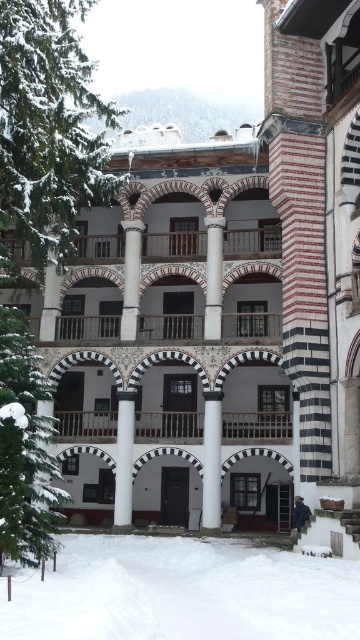
Can you confirm if white smooth column at center is bigger than white marble column at center?

Indeed, white smooth column at center has a larger size compared to white marble column at center.

The width and height of the screenshot is (360, 640). What do you see at coordinates (212, 460) in the screenshot? I see `white smooth column at center` at bounding box center [212, 460].

The width and height of the screenshot is (360, 640). Describe the element at coordinates (212, 460) in the screenshot. I see `white smooth column at center` at that location.

In order to click on white smooth column at center in this screenshot , I will do (x=212, y=460).

Can you confirm if white smooth column at center is wider than white glossy column at center?

No, white smooth column at center is not wider than white glossy column at center.

Does white smooth column at center have a larger size compared to white glossy column at center?

Yes.

I want to click on white smooth column at center, so click(x=212, y=460).

Image resolution: width=360 pixels, height=640 pixels. I want to click on white smooth column at center, so click(x=212, y=460).

Does white powdery snow at lower center appear over white marble column at center?

Actually, white powdery snow at lower center is below white marble column at center.

What do you see at coordinates (181, 593) in the screenshot?
I see `white powdery snow at lower center` at bounding box center [181, 593].

Does point (231, 604) lie in front of point (132, 323)?

That is True.

The image size is (360, 640). I want to click on white powdery snow at lower center, so click(181, 593).